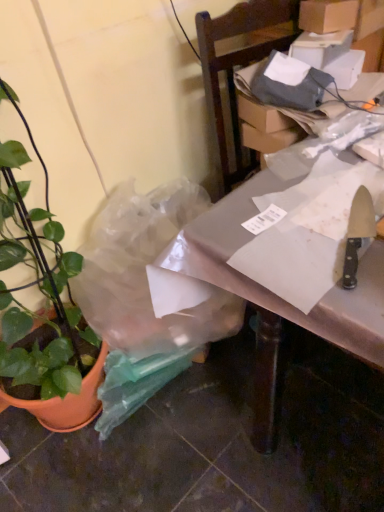
This screenshot has height=512, width=384. In order to click on free region on the left part of polished metal knife at right in this screenshot , I will do `click(278, 255)`.